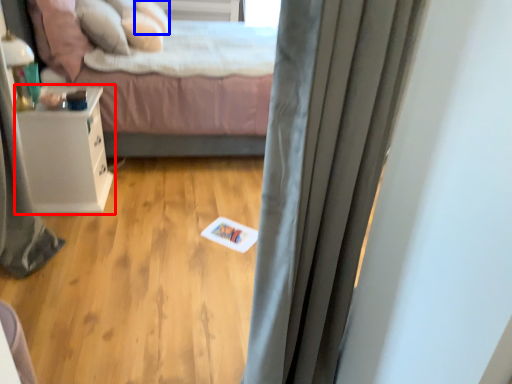
Question: Which object appears closest to the camera in this image, nightstand (highlighted by a red box) or pillow (highlighted by a blue box)?

Choices:
 (A) nightstand
 (B) pillow

Answer: (A)